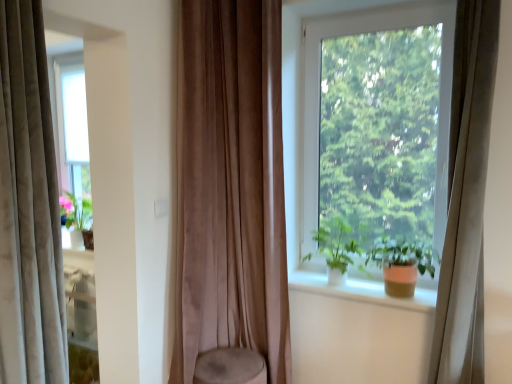
Image resolution: width=512 pixels, height=384 pixels. In order to click on transparent glass window at center in this screenshot , I will do `click(318, 103)`.

Describe the element at coordinates (466, 199) in the screenshot. The height and width of the screenshot is (384, 512). I see `beige velvet curtain at right, arranged as the 1th curtain when viewed from the right` at that location.

This screenshot has width=512, height=384. What do you see at coordinates (230, 186) in the screenshot? I see `suede-like brown curtain at center, the 2th curtain viewed from the left` at bounding box center [230, 186].

Image resolution: width=512 pixels, height=384 pixels. What do you see at coordinates (362, 291) in the screenshot?
I see `white smooth window sill at center` at bounding box center [362, 291].

The height and width of the screenshot is (384, 512). I want to click on transparent glass window at center, so click(x=318, y=103).

What's the angular difference between green matte plant at window and transparent glass window at center's facing directions?

2.86 degrees separate the facing orientations of green matte plant at window and transparent glass window at center.

Between point (340, 239) and point (445, 63), which one is positioned behind?

Point (340, 239)

Is green matte plant at window in contact with transparent glass window at center?

No, green matte plant at window is not with transparent glass window at center.

From a real-world perspective, which object stands above the other?

transparent glass window at center.

Which object is further away from the camera, velvet beige curtain at left, the 1th curtain from the left, or transparent glass window at center?

transparent glass window at center is further from the camera.

From a real-world perspective, who is located lower, velvet beige curtain at left, the 1th curtain from the left, or transparent glass window at center?

In real-world perspective, velvet beige curtain at left, the 1th curtain from the left, is lower.

Does velvet beige curtain at left, the 1th curtain from the left, have a larger size compared to transparent glass window at center?

Indeed, velvet beige curtain at left, the 1th curtain from the left, has a larger size compared to transparent glass window at center.

Between point (30, 143) and point (347, 23), which one is positioned behind?

The point (347, 23) is more distant.

Is suede-like brown curtain at center, the second curtain viewed from the right, inside or outside of matte orange pot at window?

suede-like brown curtain at center, the second curtain viewed from the right, is outside matte orange pot at window.

Is suede-like brown curtain at center, the second curtain viewed from the right, facing away from matte orange pot at window?

No, suede-like brown curtain at center, the second curtain viewed from the right,'s orientation is not away from matte orange pot at window.

Measure the distance between suede-like brown curtain at center, the second curtain viewed from the right, and matte orange pot at window.

The distance of suede-like brown curtain at center, the second curtain viewed from the right, from matte orange pot at window is 78.36 centimeters.

In terms of size, does suede-like brown curtain at center, the second curtain viewed from the right, appear bigger or smaller than matte orange pot at window?

suede-like brown curtain at center, the second curtain viewed from the right, is bigger than matte orange pot at window.

Is transparent glass window at center positioned beyond the bounds of white smooth window sill at center?

transparent glass window at center lies outside white smooth window sill at center's area.

Between transparent glass window at center and white smooth window sill at center, which one is positioned behind?

transparent glass window at center is further away from the camera.

How different are the orientations of transparent glass window at center and white smooth window sill at center in degrees?

There is a 0.18-degree angle between the facing directions of transparent glass window at center and white smooth window sill at center.

From the picture: Between matte orange pot at window and suede-like brown curtain at center, the 2th curtain viewed from the left, which one has less height?

matte orange pot at window.

Considering the sizes of objects matte orange pot at window and suede-like brown curtain at center, the 2th curtain viewed from the left, in the image provided, who is smaller, matte orange pot at window or suede-like brown curtain at center, the 2th curtain viewed from the left,?

Smaller between the two is matte orange pot at window.

Which of these two, matte orange pot at window or suede-like brown curtain at center, the 2th curtain viewed from the left, is wider?

matte orange pot at window is wider.

Visually, is beige velvet curtain at right, arranged as the 1th curtain when viewed from the right, positioned to the left or to the right of suede-like brown curtain at center, the second curtain viewed from the right?

beige velvet curtain at right, arranged as the 1th curtain when viewed from the right, is positioned on suede-like brown curtain at center, the second curtain viewed from the right,'s right side.

Considering the relative sizes of beige velvet curtain at right, arranged as the 1th curtain when viewed from the right, and suede-like brown curtain at center, the second curtain viewed from the right, in the image provided, is beige velvet curtain at right, arranged as the 1th curtain when viewed from the right, thinner than suede-like brown curtain at center, the second curtain viewed from the right,?

In fact, beige velvet curtain at right, arranged as the 1th curtain when viewed from the right, might be wider than suede-like brown curtain at center, the second curtain viewed from the right.

How different are the orientations of beige velvet curtain at right, arranged as the 1th curtain when viewed from the right, and suede-like brown curtain at center, the second curtain viewed from the right, in degrees?

They differ by 1.05 degrees in their facing directions.

Find the location of a particular element. Image resolution: width=512 pixels, height=384 pixels. curtain that is the 1st one when counting forward from the suede-like brown curtain at center, the 2th curtain viewed from the left is located at coordinates (466, 199).

Considering the positions of objects suede-like brown curtain at center, the 2th curtain viewed from the left, and beige velvet curtain at right, arranged as the 1th curtain when viewed from the right, in the image provided, who is more to the left, suede-like brown curtain at center, the 2th curtain viewed from the left, or beige velvet curtain at right, arranged as the 1th curtain when viewed from the right,?

suede-like brown curtain at center, the 2th curtain viewed from the left.

From the image's perspective, is suede-like brown curtain at center, the second curtain viewed from the right, located beneath beige velvet curtain at right, arranged as the 1th curtain when viewed from the right?

No, from the image's perspective, suede-like brown curtain at center, the second curtain viewed from the right, is not beneath beige velvet curtain at right, arranged as the 1th curtain when viewed from the right.

This screenshot has height=384, width=512. I want to click on curtain behind the beige velvet curtain at right, arranged as the 1th curtain when viewed from the right, so click(230, 186).

This screenshot has width=512, height=384. I want to click on vegetation that appears on the left of transparent glass window at center, so click(x=336, y=243).

You are a GUI agent. You are given a task and a screenshot of the screen. Output one action in this format:
    pyautogui.click(x=<x>, y=<y>)
    Task: Click on the window behind the velvet beige curtain at left, the 3th curtain in the right-to-left sequence
    This screenshot has width=512, height=384.
    Given the screenshot: What is the action you would take?
    [x=318, y=103]

When comparing their distances from white smooth window sill at center, does transparent glass window at center or beige velvet curtain at right, arranged as the 1th curtain when viewed from the right, seem closer?

beige velvet curtain at right, arranged as the 1th curtain when viewed from the right, is positioned closer to the anchor white smooth window sill at center.

From the image, which object appears to be nearer to matte orange pot at window, velvet beige curtain at left, the 3th curtain in the right-to-left sequence, or green matte plant at window?

green matte plant at window is positioned closer to the anchor matte orange pot at window.

From the image, which object appears to be nearer to green matte plant at window, velvet beige curtain at left, the 3th curtain in the right-to-left sequence, or transparent glass window at center?

The object closer to green matte plant at window is transparent glass window at center.

Estimate the real-world distances between objects in this image. Which object is further from transparent glass window at center, matte orange pot at window or white smooth window sill at center?

Among the two, white smooth window sill at center is located further to transparent glass window at center.

Considering their positions, is white smooth window sill at center positioned closer to green matte plant at window than suede-like brown curtain at center, the 2th curtain viewed from the left?

Based on the image, white smooth window sill at center appears to be nearer to green matte plant at window.

Based on their spatial positions, is white smooth window sill at center or beige velvet curtain at right, which is the third curtain in left-to-right order, further from green matte plant at window?

The object further to green matte plant at window is beige velvet curtain at right, which is the third curtain in left-to-right order.

Estimate the real-world distances between objects in this image. Which object is further from green matte plant at window, velvet beige curtain at left, the 3th curtain in the right-to-left sequence, or beige velvet curtain at right, which is the third curtain in left-to-right order?

Based on the image, velvet beige curtain at left, the 3th curtain in the right-to-left sequence, appears to be further to green matte plant at window.

Which object lies further to the anchor point suede-like brown curtain at center, the second curtain viewed from the right, green matte plant at window or beige velvet curtain at right, which is the third curtain in left-to-right order?

beige velvet curtain at right, which is the third curtain in left-to-right order, lies further to suede-like brown curtain at center, the second curtain viewed from the right, than the other object.

Where is `vegetation between suede-like brown curtain at center, the second curtain viewed from the right, and beige velvet curtain at right, which is the third curtain in left-to-right order`? Image resolution: width=512 pixels, height=384 pixels. vegetation between suede-like brown curtain at center, the second curtain viewed from the right, and beige velvet curtain at right, which is the third curtain in left-to-right order is located at coordinates (336, 243).

At what (x,y) coordinates should I click in order to perform the action: click on houseplant between beige velvet curtain at right, arranged as the 1th curtain when viewed from the right, and white smooth window sill at center from front to back. Please return your answer as a coordinate pair (x, y). The image size is (512, 384). Looking at the image, I should click on (401, 264).

Identify the location of curtain situated between velvet beige curtain at left, the 1th curtain from the left, and white smooth window sill at center from left to right. click(x=230, y=186).

Locate an element on the screen. The image size is (512, 384). window sill between velvet beige curtain at left, the 1th curtain from the left, and beige velvet curtain at right, arranged as the 1th curtain when viewed from the right, in the horizontal direction is located at coordinates (362, 291).